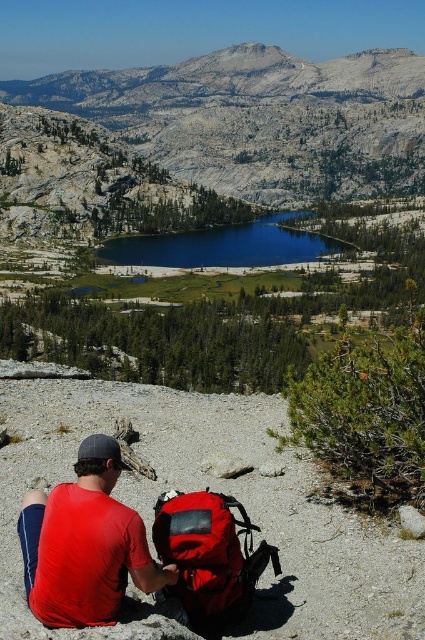
Can you confirm if gray rocky mountain at upper center is thinner than red matte shirt at lower left?

No.

Between gray rocky mountain at upper center and red matte shirt at lower left, which one appears on the left side from the viewer's perspective?

Positioned to the left is red matte shirt at lower left.

Between point (291, 193) and point (88, 474), which one is positioned in front?

Point (88, 474) is in front.

Locate an element on the screen. The height and width of the screenshot is (640, 425). gray rocky mountain at upper center is located at coordinates pos(260,120).

Locate an element on the screen. Image resolution: width=425 pixels, height=640 pixels. matte red backpack at lower center is located at coordinates click(209, 556).

Which is in front, point (197, 557) or point (269, 264)?

Point (197, 557)

Identify the location of matte red backpack at lower center. (209, 556).

Between red matte shirt at lower left and blue reflective water at center, which one has less height?

red matte shirt at lower left is shorter.

Who is positioned more to the right, red matte shirt at lower left or blue reflective water at center?

blue reflective water at center is more to the right.

You are a GUI agent. You are given a task and a screenshot of the screen. Output one action in this format:
    pyautogui.click(x=<x>, y=<y>)
    Task: Click on the red matte shirt at lower left
    Image resolution: width=425 pixels, height=640 pixels.
    Given the screenshot: What is the action you would take?
    pyautogui.click(x=85, y=544)